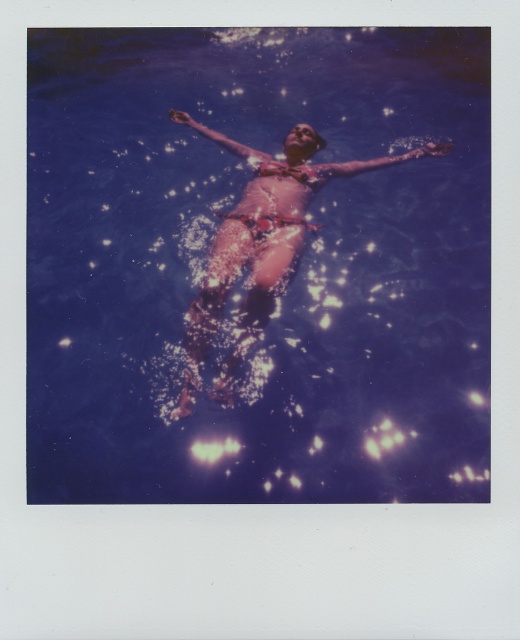
You are a photographer trying to capture the exact center of the image. According to the coordinates provided, where is the transparent blue water at center located?

The transparent blue water at center is located at the coordinates point (256,266).

You are a photographer trying to capture the floral bikini at center and the transparent blue water at center in a single shot. Based on their positions, which object should you focus on first to ensure both are in frame?

You should focus on the floral bikini at center first because the transparent blue water at center is to the left of it, so centering the bikini will naturally include the water in the frame.